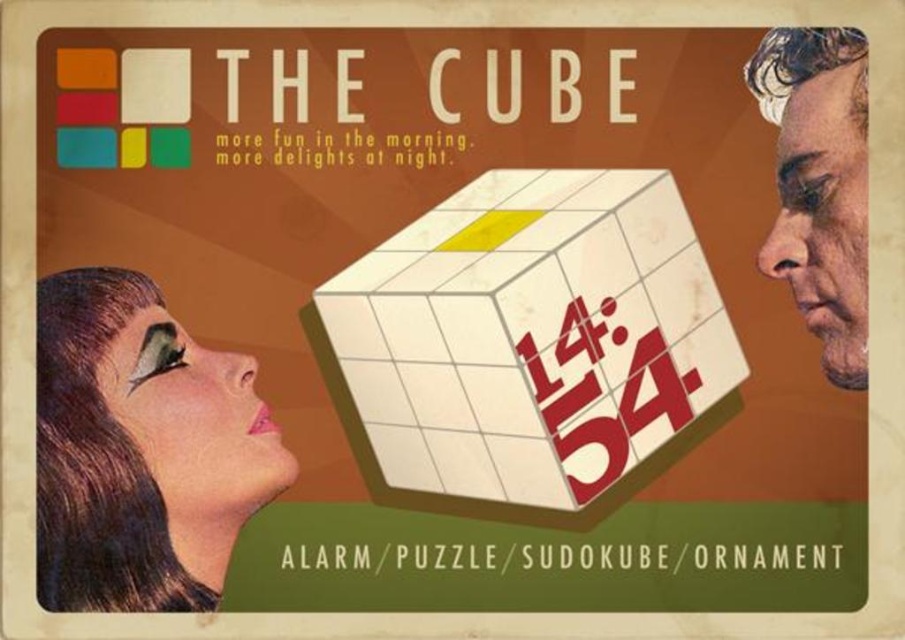
You are designing a shelf display for a gift shop. The white matte cube at center and the smooth skin face at right need to be placed on the same shelf. Considering their heights, which object should be positioned lower to ensure stability?

The white matte cube at center has a lesser height compared to the smooth skin face at right, so it should be placed lower on the shelf to ensure stability.

You are designing a poster for The Cube and need to ensure proper spacing between the two faces. Given that the matte black face at lower left and the smooth skin face at right are part of the design, which face requires more vertical space due to its height?

The smooth skin face at right requires more vertical space because it is taller than the matte black face at lower left.